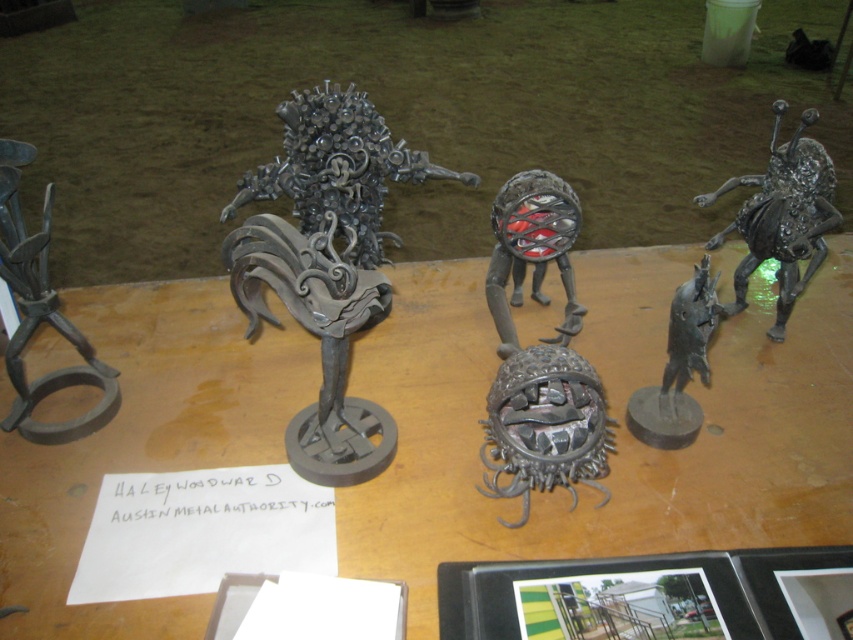
You are an art curator planning to move the metallic sculpture at center and the matte black metal sphere at center closer together for a new exhibition layout. The museum requires that all sculptures must be at least 12 inches apart for safety. Can you move them as planned?

The metallic sculpture at center and the matte black metal sphere at center are currently 11.80 inches apart. Since the museum requires a minimum of 12 inches between sculptures for safety, moving them closer would violate this rule. Therefore, you cannot move them as planned.

You are an art curator examining the metal sculptures on the wooden table. You notice two points of interest marked as point 1 at coordinates point (346,403) and point 2 at coordinates point (509,214). Which point is nearer to you?

Point (346,403) is closer to the viewer than point (509,214).